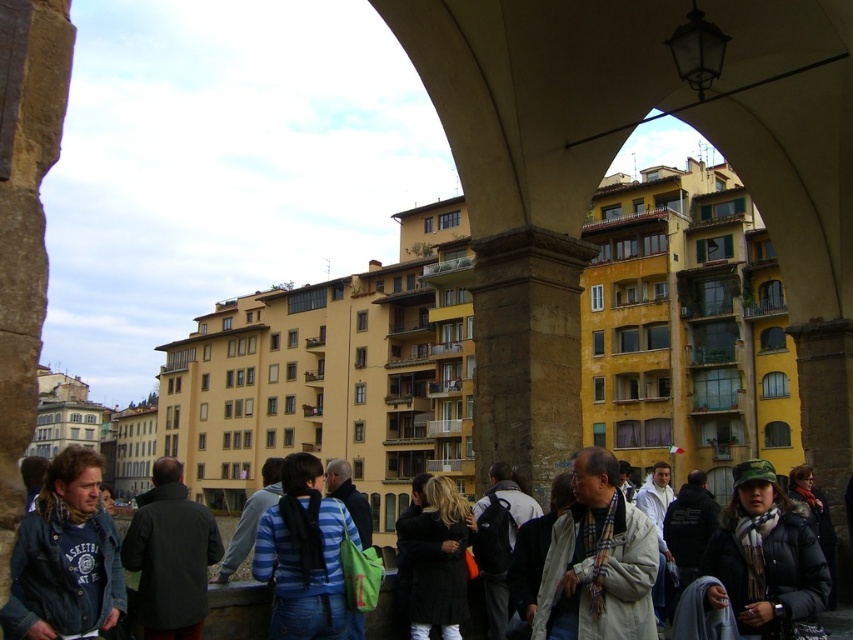
Question: Is black wool coat at center closer to the viewer compared to dark gray backpack at center?

Choices:
 (A) yes
 (B) no

Answer: (A)

Question: Is camouflage fabric hat at lower right positioned behind light blue denim jacket at center?

Choices:
 (A) yes
 (B) no

Answer: (B)

Question: Which object appears closest to the camera in this image?

Choices:
 (A) white wool scarf at lower right
 (B) dark gray backpack at center
 (C) white wool scarf at center

Answer: (C)

Question: Which object is the farthest from the striped cotton shirt at center?

Choices:
 (A) black wool coat at center
 (B) white wool scarf at lower right

Answer: (B)

Question: Which point is farther to the camera?

Choices:
 (A) camouflage fabric hat at lower right
 (B) dark gray backpack at center
 (C) striped cotton shirt at center
 (D) dark gray coat at center

Answer: (B)

Question: Can you confirm if denim jacket at lower left is positioned above white wool scarf at lower right?

Choices:
 (A) yes
 (B) no

Answer: (A)